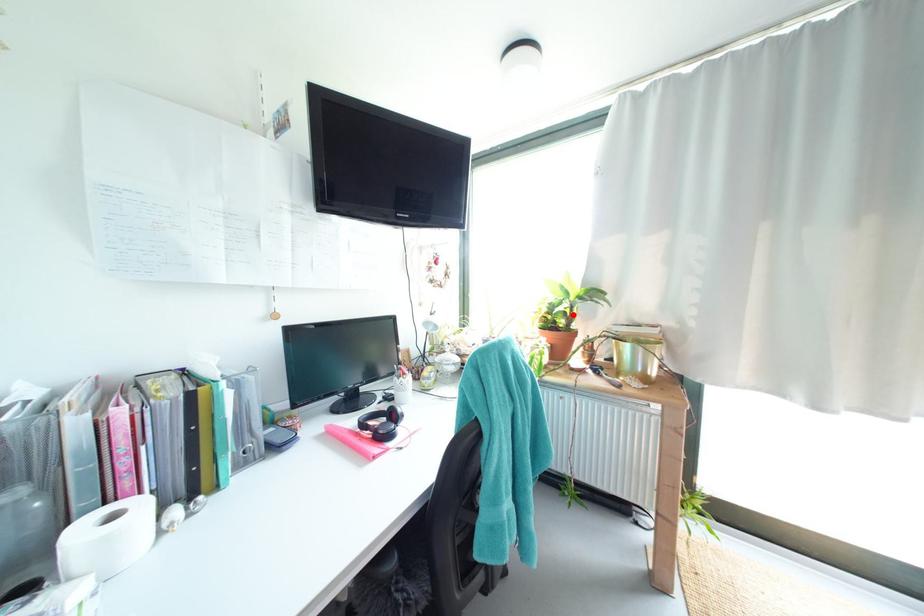
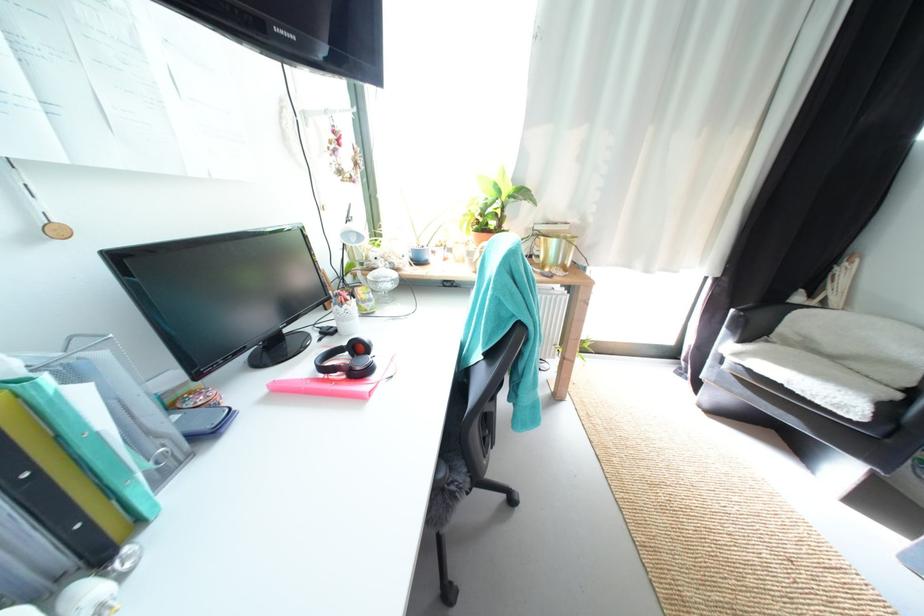
Where in the second image is the point corresponding to the highlighted location from the first image?

(505, 216)